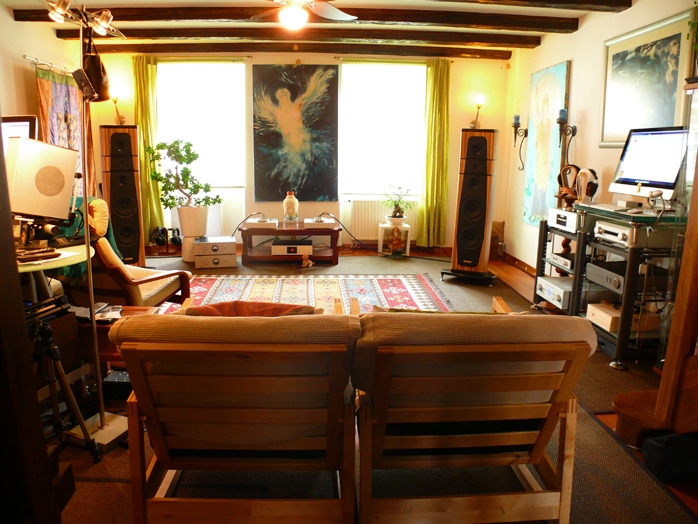
In order to click on place to sit in this screenshot , I will do `click(144, 274)`, `click(239, 316)`, `click(422, 319)`.